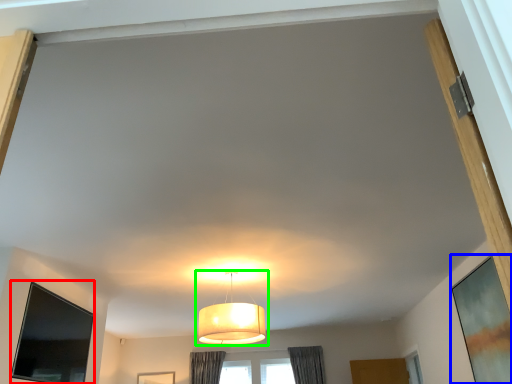
Question: Which object is positioned farthest from window screen (highlighted by a red box)? Select from window screen (highlighted by a blue box) and lamp (highlighted by a green box).

Choices:
 (A) window screen
 (B) lamp

Answer: (A)